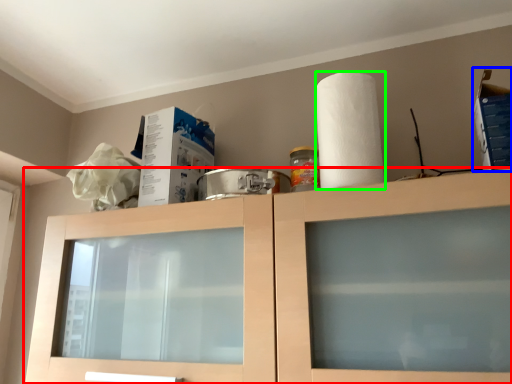
Question: Considering the real-world distances, which object is closest to cabinetry (highlighted by a red box)? box (highlighted by a blue box) or paper towel (highlighted by a green box).

Choices:
 (A) box
 (B) paper towel

Answer: (B)